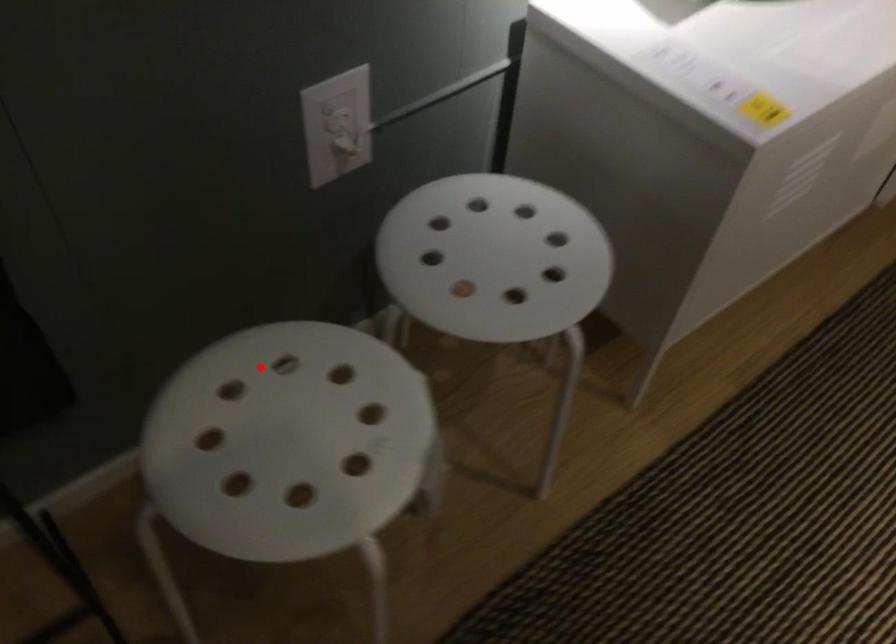
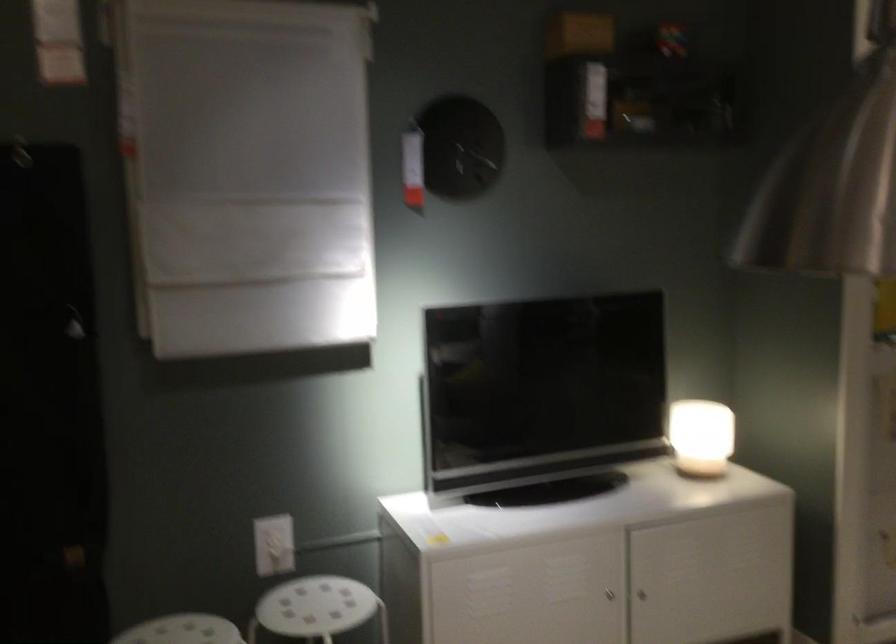
The point at the highlighted location is marked in the first image. Where is the corresponding point in the second image?

(182, 630)